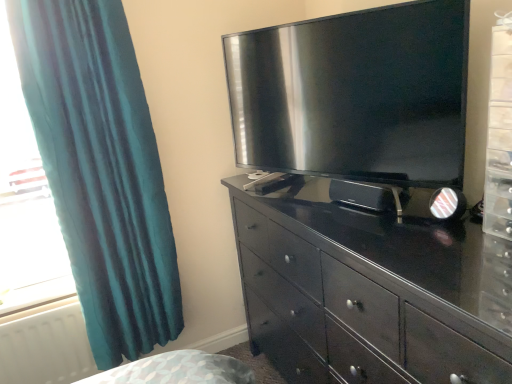
Question: Considering the positions of glossy dark wood chest of drawers at center and white matte radiator at lower left in the image, is glossy dark wood chest of drawers at center taller or shorter than white matte radiator at lower left?

Choices:
 (A) short
 (B) tall

Answer: (B)

Question: Which is correct: glossy dark wood chest of drawers at center is inside white matte radiator at lower left, or outside of it?

Choices:
 (A) inside
 (B) outside

Answer: (B)

Question: Which object is positioned farthest from the glossy dark wood chest of drawers at center?

Choices:
 (A) white matte radiator at lower left
 (B) teal fabric curtain at left
 (C) black glossy television at upper center

Answer: (A)

Question: Which object is positioned farthest from the black glossy television at upper center?

Choices:
 (A) teal fabric curtain at left
 (B) glossy dark wood chest of drawers at center
 (C) white matte radiator at lower left

Answer: (C)